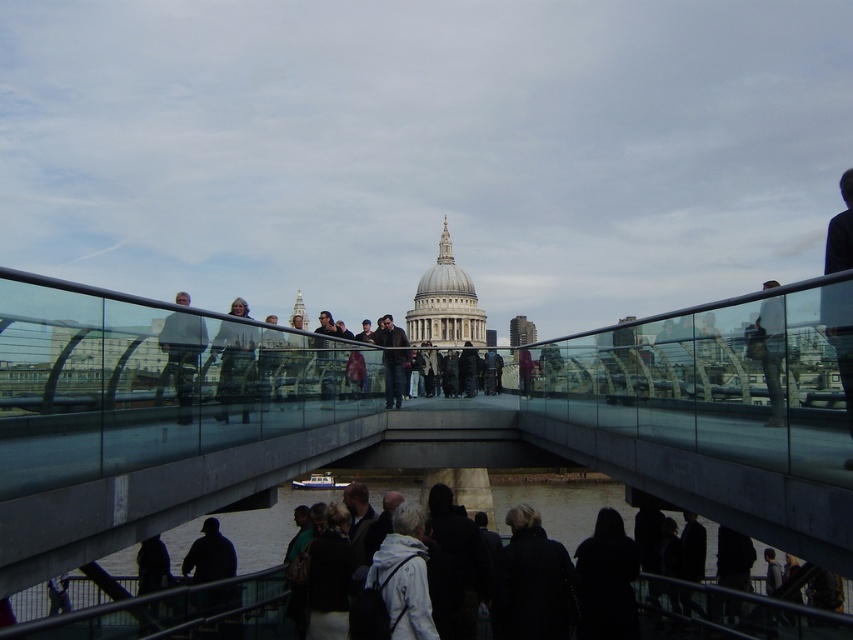
Does point (695, 330) come closer to viewer compared to point (328, 625)?

Yes, it is.

Does glass pedestrian bridge at center appear under dark gray sweater at lower center?

Actually, glass pedestrian bridge at center is above dark gray sweater at lower center.

You are a GUI agent. You are given a task and a screenshot of the screen. Output one action in this format:
    pyautogui.click(x=<x>, y=<y>)
    Task: Click on the glass pedestrian bridge at center
    
    Given the screenshot: What is the action you would take?
    pyautogui.click(x=415, y=420)

This screenshot has width=853, height=640. What do you see at coordinates (534, 580) in the screenshot?
I see `dark wool coat at center` at bounding box center [534, 580].

Which is above, dark wool coat at center or white matte jacket at center?

Positioned higher is white matte jacket at center.

Is point (520, 595) closer to viewer compared to point (416, 544)?

No, (520, 595) is further to viewer.

Identify the location of dark wool coat at center. The width and height of the screenshot is (853, 640). (534, 580).

Can you confirm if dark wool coat at center is shorter than dark gray sweater at lower center?

Indeed, dark wool coat at center has a lesser height compared to dark gray sweater at lower center.

Identify the location of dark wool coat at center. (534, 580).